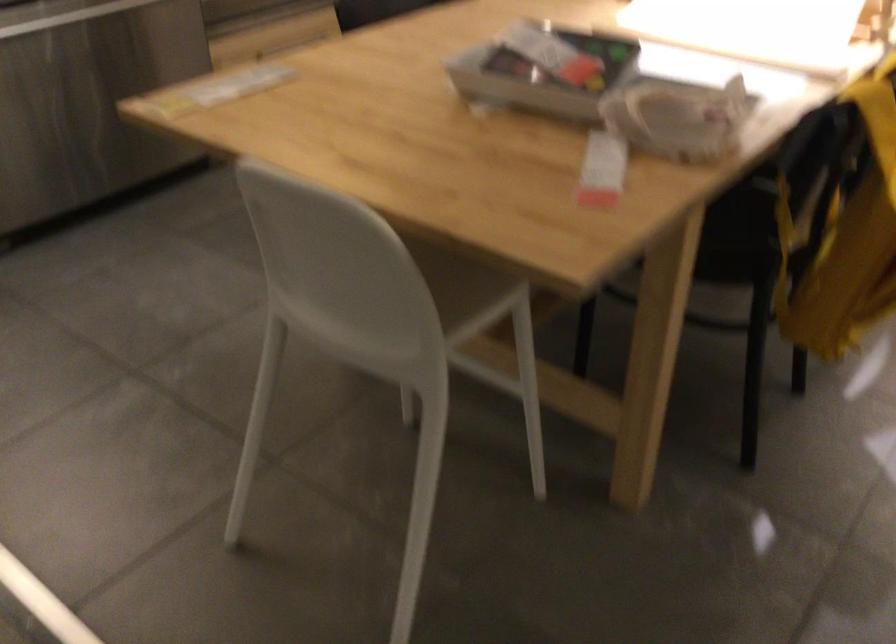
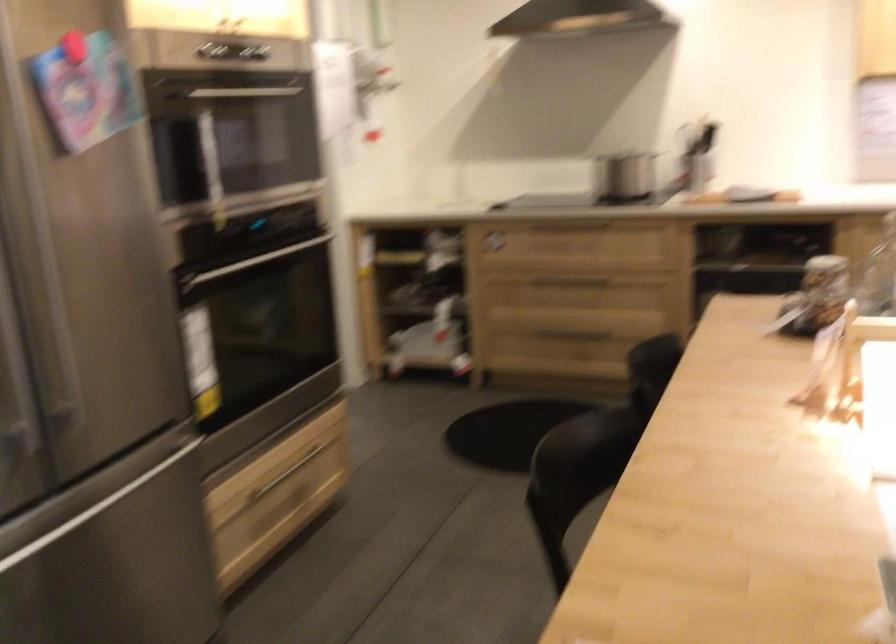
In a continuous first-person perspective shot, in which direction is the camera moving?

The cameraman moved toward left, forward.